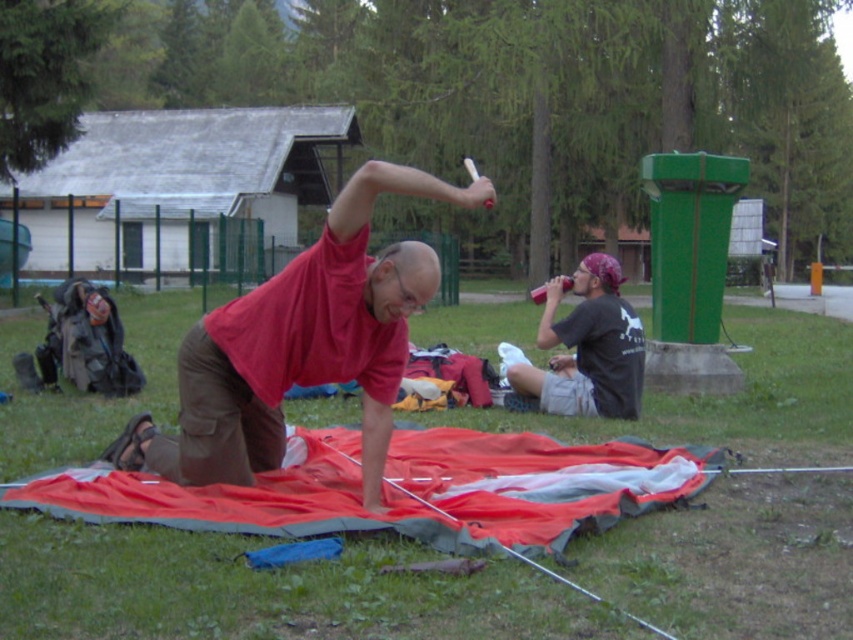
You are organizing a picnic and need to cover a large group of people. You have a red fabric blanket at center and a matte red shirt at center. Which item would be more suitable for covering more people?

The red fabric blanket at center is larger in size compared to the matte red shirt at center, so it would be more suitable for covering a larger group of people.

You are standing in the park scene and want to place a 10 foot long picnic blanket on the green grass at lower center. Can you fit it there without overlapping any other objects?

The green grass at lower center and viewer are 12.56 feet apart, so the 10 foot long picnic blanket can fit on the green grass at lower center since the distance between you and the grass is greater than the blanket length.